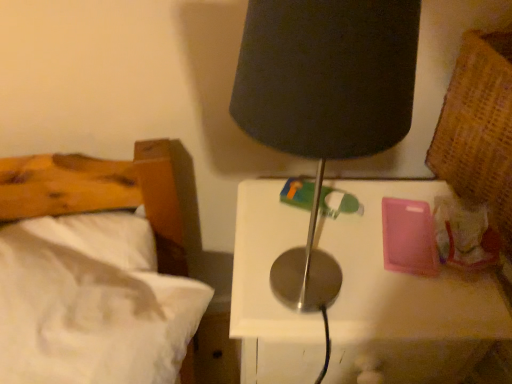
Question: Is black fabric lamp at upper center oriented away from metallic white nightstand at center?

Choices:
 (A) no
 (B) yes

Answer: (A)

Question: Is black fabric lamp at upper center facing towards metallic white nightstand at center?

Choices:
 (A) yes
 (B) no

Answer: (B)

Question: Is black fabric lamp at upper center closer to camera compared to metallic white nightstand at center?

Choices:
 (A) yes
 (B) no

Answer: (A)

Question: Is black fabric lamp at upper center outside metallic white nightstand at center?

Choices:
 (A) no
 (B) yes

Answer: (B)

Question: Considering the relative sizes of black fabric lamp at upper center and metallic white nightstand at center in the image provided, is black fabric lamp at upper center shorter than metallic white nightstand at center?

Choices:
 (A) no
 (B) yes

Answer: (B)

Question: Is black fabric lamp at upper center to the right of metallic white nightstand at center from the viewer's perspective?

Choices:
 (A) no
 (B) yes

Answer: (A)

Question: Does white soft bed at left have a lesser width compared to black fabric lamp at upper center?

Choices:
 (A) no
 (B) yes

Answer: (A)

Question: Is white soft bed at left facing towards black fabric lamp at upper center?

Choices:
 (A) no
 (B) yes

Answer: (A)

Question: Is white soft bed at left wider than black fabric lamp at upper center?

Choices:
 (A) no
 (B) yes

Answer: (B)

Question: Is white soft bed at left facing away from black fabric lamp at upper center?

Choices:
 (A) no
 (B) yes

Answer: (A)

Question: Is white soft bed at left shorter than black fabric lamp at upper center?

Choices:
 (A) no
 (B) yes

Answer: (B)

Question: Considering the relative sizes of white soft bed at left and black fabric lamp at upper center in the image provided, is white soft bed at left taller than black fabric lamp at upper center?

Choices:
 (A) yes
 (B) no

Answer: (B)

Question: Considering the relative sizes of metallic white nightstand at center and white soft bed at left in the image provided, is metallic white nightstand at center smaller than white soft bed at left?

Choices:
 (A) yes
 (B) no

Answer: (B)